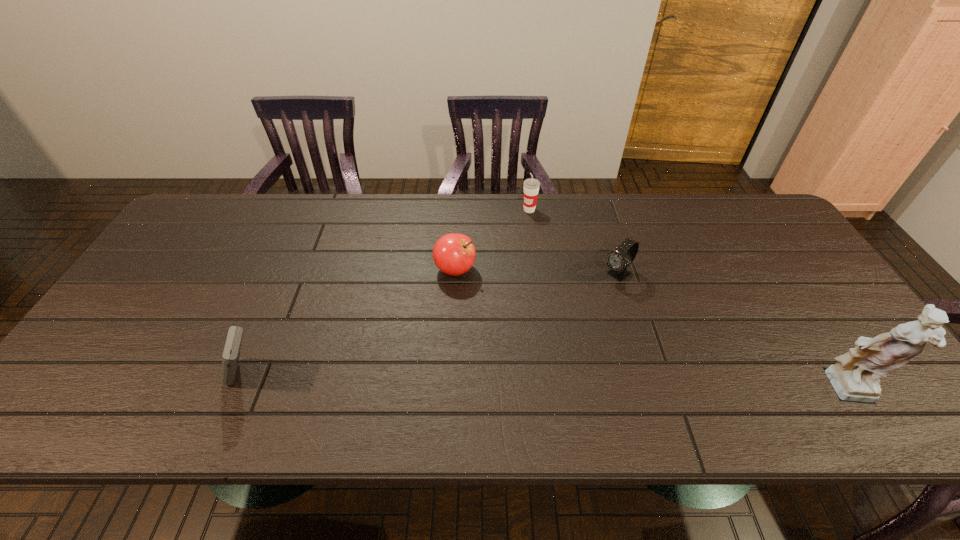
Locate which object ranks in proximity to the figurine. Please provide its 2D coordinates. Your answer should be formatted as a tuple, i.e. [(x, y)], where the tuple contains the x and y coordinates of a point satisfying the conditions above.

[(619, 259)]

Identify the location of vacant space that satisfies the following two spatial constraints: 1. on the front side of the second object from left to right; 2. on the right side of the fourth object from left to right. (455, 275).